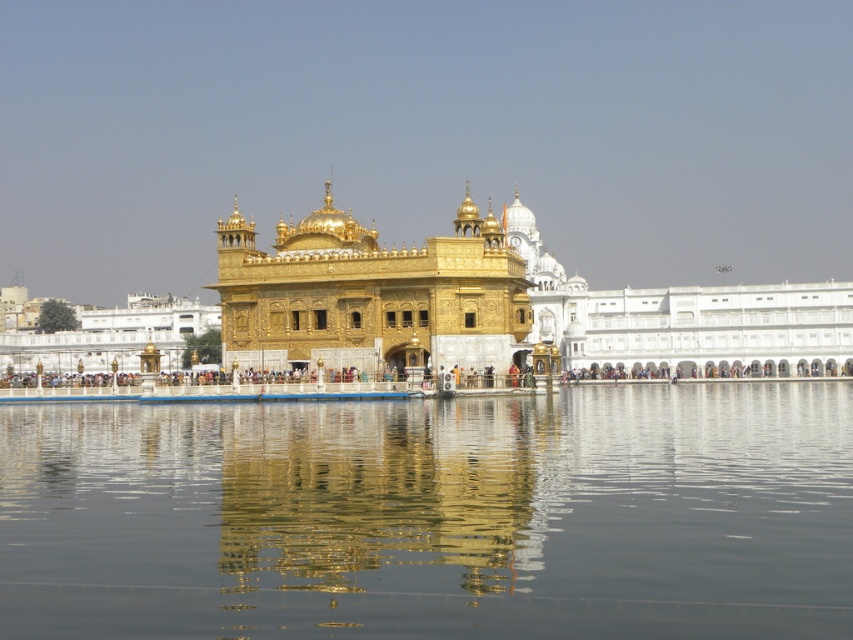
Question: Is transparent liquid water at center smaller than gold shiny palace at center?

Choices:
 (A) yes
 (B) no

Answer: (A)

Question: Does transparent liquid water at center appear under gold shiny palace at center?

Choices:
 (A) no
 (B) yes

Answer: (B)

Question: Which point is closer to the camera?

Choices:
 (A) (683, 358)
 (B) (16, 449)

Answer: (B)

Question: Does transparent liquid water at center appear under gold shiny palace at center?

Choices:
 (A) no
 (B) yes

Answer: (B)